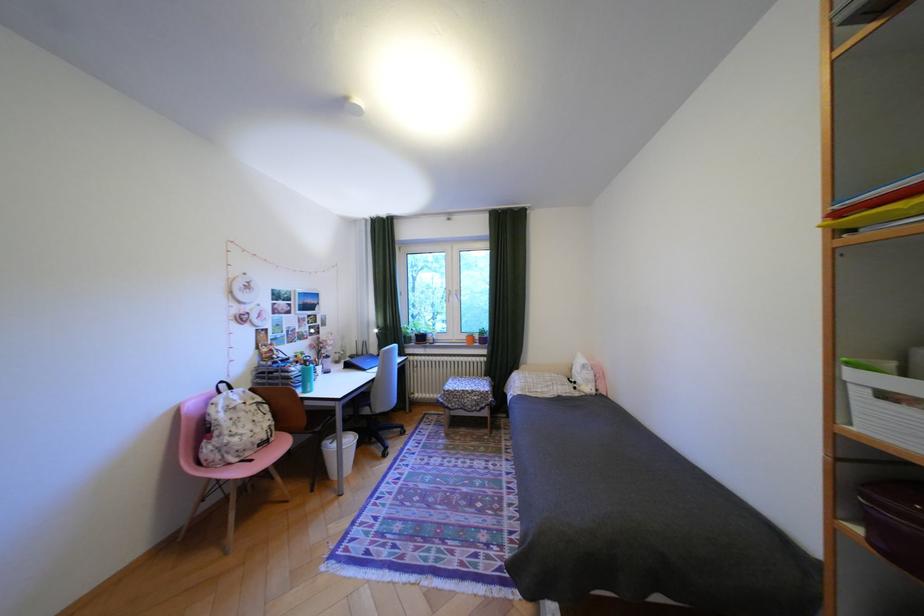
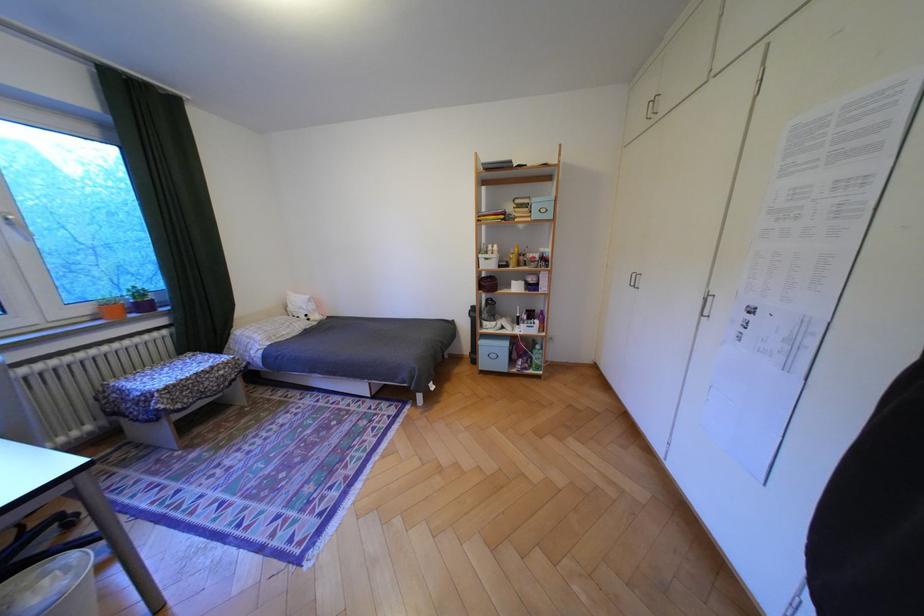
In the second image, find the point that corresponds to point (862, 374) in the first image.

(492, 256)